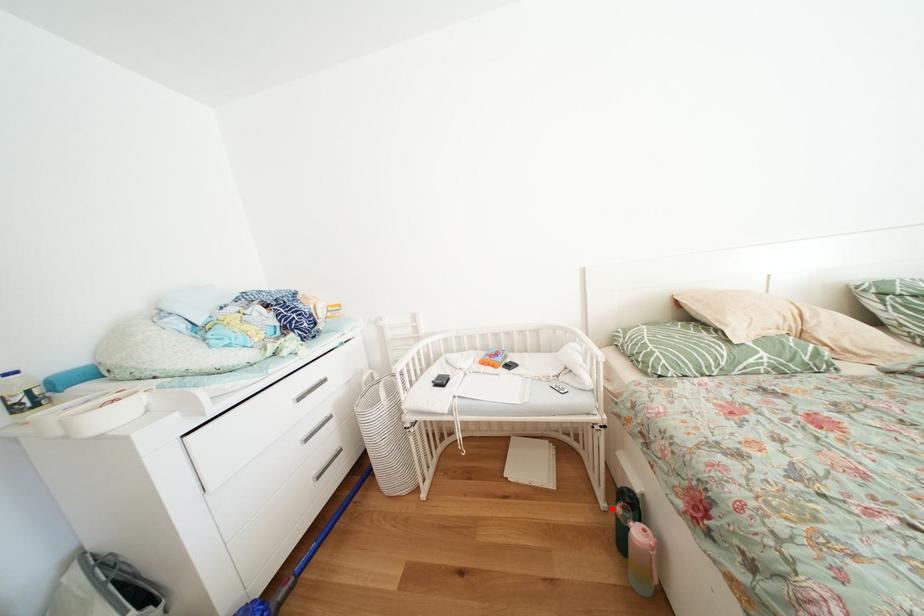
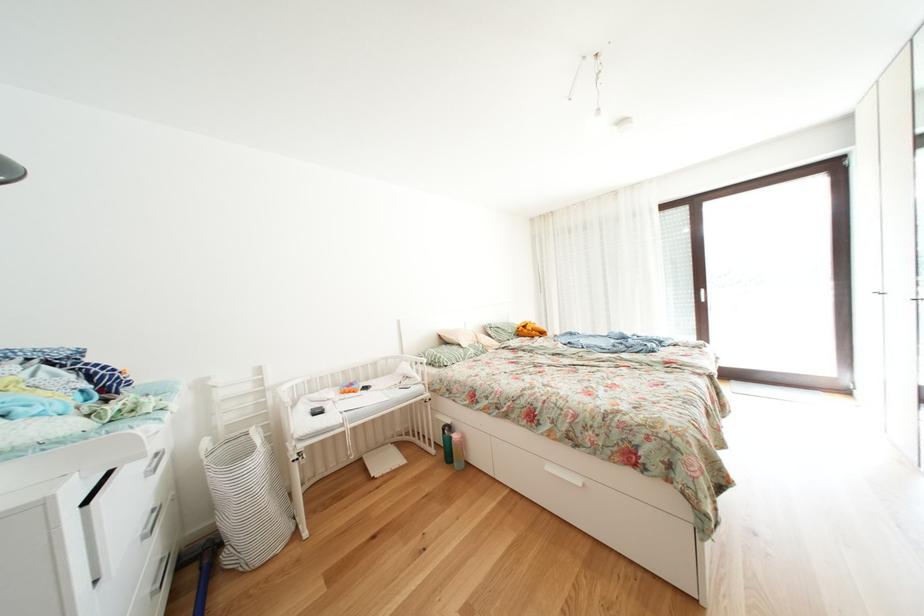
Question: I am providing you with two images of the same scene from different viewpoints. Image1 has a red point marked. In image2, the corresponding 3D location appears at what relative position? Reply with the corresponding letter.

Choices:
 (A) Closer
 (B) Farther

Answer: (B)